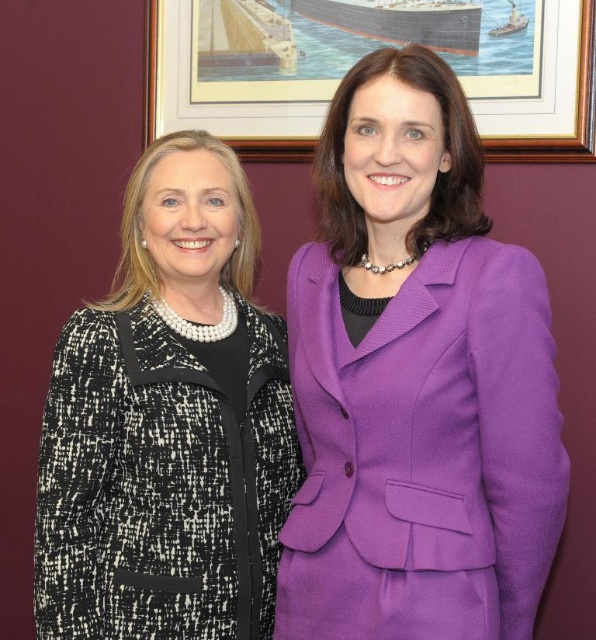
Question: Where is black textured blazer at left located in relation to wooden frame at upper center in the image?

Choices:
 (A) above
 (B) below

Answer: (B)

Question: Among these points, which one is farthest from the camera?

Choices:
 (A) (57, 348)
 (B) (359, 3)

Answer: (B)

Question: Can you confirm if purple woolen suit at center is positioned above black textured blazer at left?

Choices:
 (A) no
 (B) yes

Answer: (B)

Question: Which of the following is the farthest from the observer?

Choices:
 (A) wooden frame at upper center
 (B) black textured blazer at left

Answer: (A)

Question: Which object is the closest to the wooden frame at upper center?

Choices:
 (A) purple woolen suit at center
 (B) black textured blazer at left

Answer: (B)

Question: Observing the image, what is the correct spatial positioning of purple woolen suit at center in reference to black textured blazer at left?

Choices:
 (A) above
 (B) below

Answer: (A)